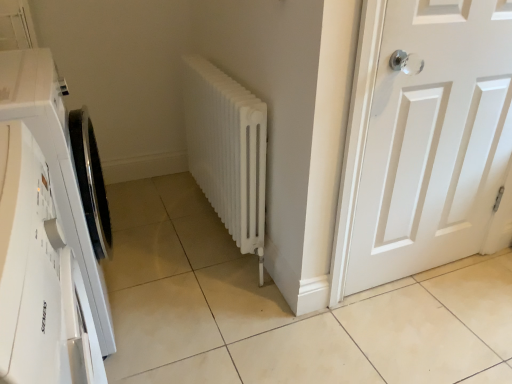
Question: Is white matte radiator at center located within white matte/waterproof washing machine at left?

Choices:
 (A) yes
 (B) no

Answer: (B)

Question: Is the surface of white matte/waterproof washing machine at left in direct contact with white matte radiator at center?

Choices:
 (A) no
 (B) yes

Answer: (A)

Question: Considering the relative sizes of white matte/waterproof washing machine at left and white matte radiator at center in the image provided, is white matte/waterproof washing machine at left thinner than white matte radiator at center?

Choices:
 (A) yes
 (B) no

Answer: (B)

Question: Is white matte/waterproof washing machine at left facing towards white matte radiator at center?

Choices:
 (A) no
 (B) yes

Answer: (A)

Question: Does white matte/waterproof washing machine at left appear on the left side of white matte radiator at center?

Choices:
 (A) no
 (B) yes

Answer: (B)

Question: Is white matte radiator at center spatially inside white matte/waterproof washing machine at left, or outside of it?

Choices:
 (A) inside
 (B) outside

Answer: (B)

Question: Considering the relative positions of white matte radiator at center and white matte/waterproof washing machine at left in the image provided, is white matte radiator at center to the left or to the right of white matte/waterproof washing machine at left?

Choices:
 (A) left
 (B) right

Answer: (B)

Question: From the image's perspective, is white matte radiator at center above or below white matte/waterproof washing machine at left?

Choices:
 (A) below
 (B) above

Answer: (B)

Question: Considering their positions, is white matte radiator at center located in front of or behind white matte/waterproof washing machine at left?

Choices:
 (A) front
 (B) behind

Answer: (B)

Question: Is white matte door at right situated inside white matte radiator at center or outside?

Choices:
 (A) outside
 (B) inside

Answer: (A)

Question: Considering the positions of white matte door at right and white matte radiator at center in the image, is white matte door at right wider or thinner than white matte radiator at center?

Choices:
 (A) wide
 (B) thin

Answer: (B)

Question: In terms of size, does white matte door at right appear bigger or smaller than white matte radiator at center?

Choices:
 (A) big
 (B) small

Answer: (B)

Question: From the image's perspective, relative to white matte radiator at center, is white matte door at right above or below?

Choices:
 (A) above
 (B) below

Answer: (B)

Question: Based on their sizes in the image, would you say white matte/waterproof washing machine at left is bigger or smaller than white matte door at right?

Choices:
 (A) big
 (B) small

Answer: (A)

Question: From a real-world perspective, is white matte/waterproof washing machine at left physically located above or below white matte door at right?

Choices:
 (A) above
 (B) below

Answer: (B)